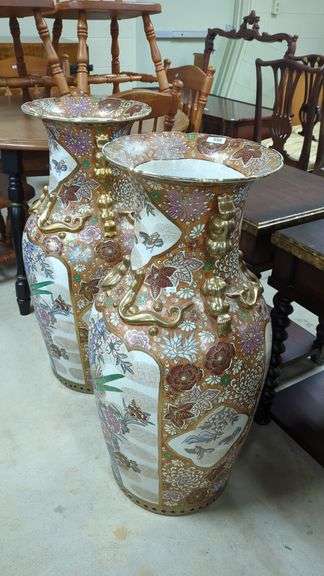
In order to click on light wood chairs in this screenshot , I will do `click(101, 9)`, `click(18, 5)`, `click(196, 78)`, `click(160, 107)`.